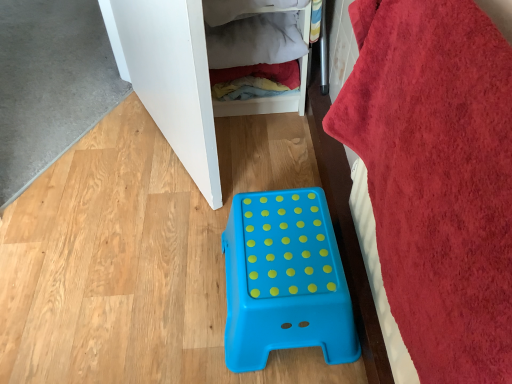
Question: Is white matte cabinet at upper left, placed as the second furniture when sorted from right to left, wider or thinner than wooden/textured clothes at upper center?

Choices:
 (A) wide
 (B) thin

Answer: (B)

Question: In terms of height, does white matte cabinet at upper left, placed as the second furniture when sorted from right to left, look taller or shorter compared to wooden/textured clothes at upper center?

Choices:
 (A) tall
 (B) short

Answer: (A)

Question: Based on their relative distances, which object is farther from the red plush bath towel at right?

Choices:
 (A) white matte cabinet at upper left, acting as the second furniture starting from the bottom
 (B) wooden/textured clothes at upper center
 (C) blue plastic step stool at center, the first furniture when ordered from bottom to top

Answer: (B)

Question: Based on their relative distances, which object is nearer to the red plush bath towel at right?

Choices:
 (A) blue plastic step stool at center, the 1th furniture in the right-to-left sequence
 (B) white matte cabinet at upper left, marked as the first furniture in a left-to-right arrangement
 (C) wooden/textured clothes at upper center

Answer: (A)